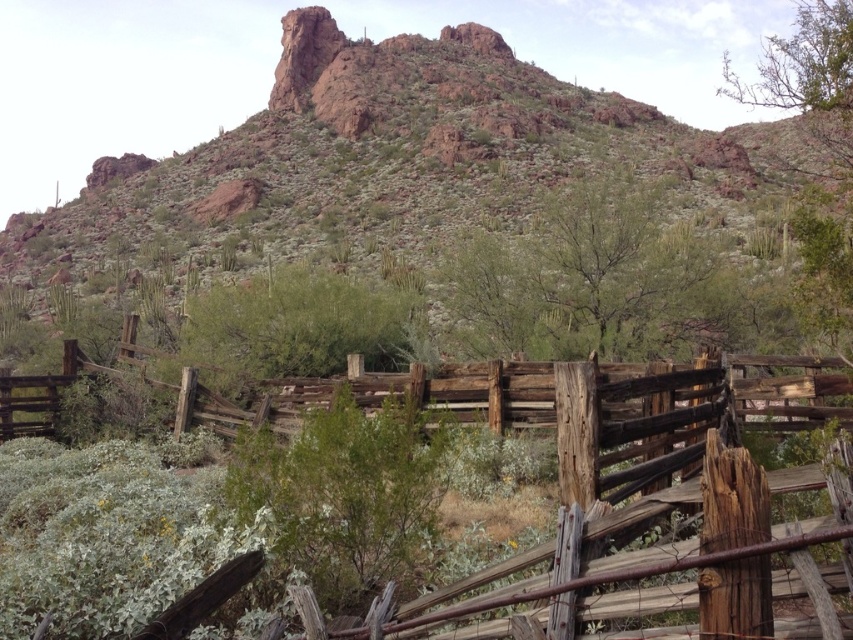
Based on the photo, you are planning to take a photo of the rusty rock formation at upper center and the weathered wood fence at center. Which object is wider in the image?

The rusty rock formation at upper center is wider than the weathered wood fence at center.

From the picture: You are a hiker trying to navigate through the desert. You see the rusty rock formation at upper center and the weathered wood fence at center. Which object is closer to you?

The rusty rock formation at upper center is closer because the weathered wood fence at center is behind it.

You are standing in the desert scene and want to walk from the wooden fence to the rocky hill. Which point, point (486,144) or point (654,589), is closer to you as you start your journey?

Point (486,144) is closer to you because it is further to the viewer than point (654,589).